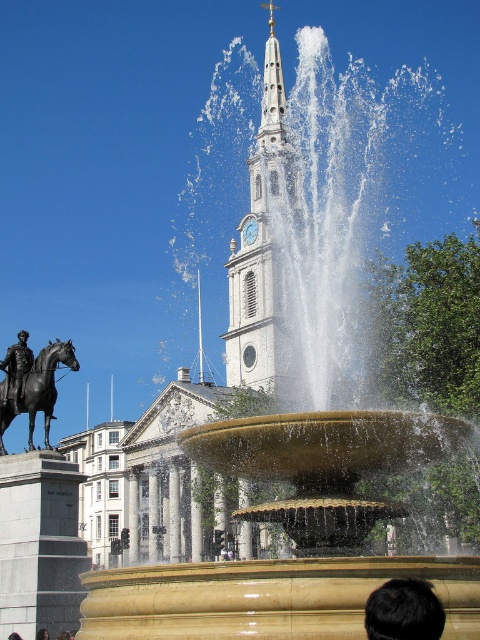
Question: Which point is closer to the camera?

Choices:
 (A) polished bronze statue at left
 (B) black hair at lower center
 (C) polished bronze horse at center-left
 (D) white stone clock tower at center

Answer: (B)

Question: In this image, where is white stone clock tower at center located relative to polished bronze statue at left?

Choices:
 (A) right
 (B) left

Answer: (A)

Question: Among these points, which one is farthest from the camera?

Choices:
 (A) (16, 376)
 (B) (283, 92)
 (C) (36, 406)

Answer: (B)

Question: Where is black hair at lower center located in relation to polished bronze statue at left in the image?

Choices:
 (A) above
 (B) below

Answer: (B)

Question: Which point appears closest to the camera in this image?

Choices:
 (A) (441, 624)
 (B) (265, 100)
 (C) (19, 394)

Answer: (A)

Question: Is black hair at lower center bigger than polished bronze horse at center-left?

Choices:
 (A) yes
 (B) no

Answer: (B)